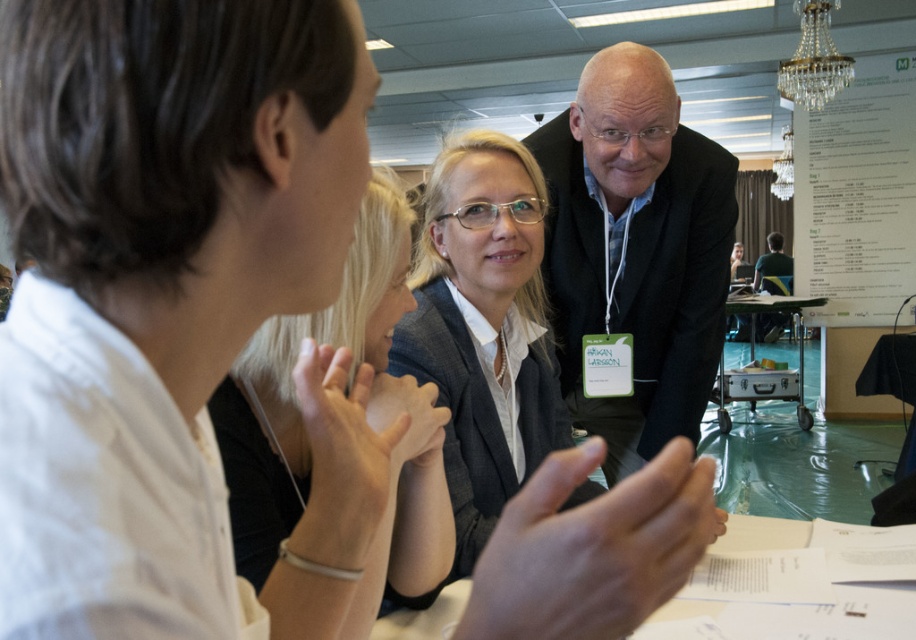
Can you confirm if matte gray blazer at center is positioned above white paper at upper right?

No, matte gray blazer at center is not above white paper at upper right.

Is matte gray blazer at center wider than white paper at upper right?

No.

The image size is (916, 640). Describe the element at coordinates (483, 328) in the screenshot. I see `matte gray blazer at center` at that location.

Where is `matte gray blazer at center`? This screenshot has width=916, height=640. matte gray blazer at center is located at coordinates (483, 328).

Is metallic suitcase at center above green fabric shirt at center?

No, metallic suitcase at center is not above green fabric shirt at center.

The width and height of the screenshot is (916, 640). I want to click on metallic suitcase at center, so click(x=759, y=365).

Is point (721, 406) farther from viewer compared to point (770, 260)?

No.

Where is `metallic suitcase at center`? Image resolution: width=916 pixels, height=640 pixels. metallic suitcase at center is located at coordinates (759, 365).

From the picture: Is white paper at upper right closer to camera compared to metallic suitcase at center?

No, it is behind metallic suitcase at center.

Which is below, white paper at upper right or metallic suitcase at center?

metallic suitcase at center

Between point (818, 246) and point (722, 413), which one is positioned in front?

Point (818, 246)

At what (x,y) coordinates should I click in order to perform the action: click on white paper at upper right. Please return your answer as a coordinate pair (x, y). Image resolution: width=916 pixels, height=640 pixels. Looking at the image, I should click on (x=857, y=196).